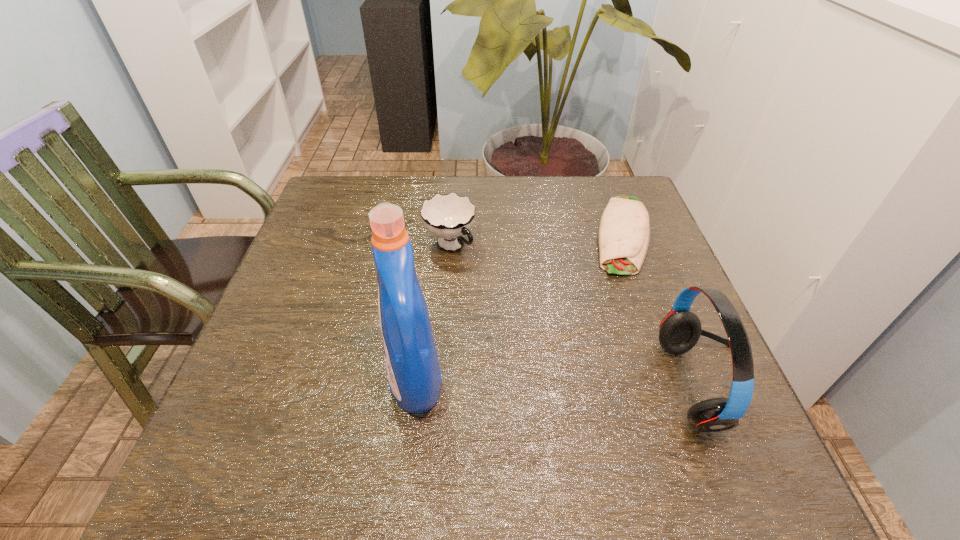
Find the location of a particular element. Image resolution: width=960 pixels, height=540 pixels. free space located at the bitten end of the shortest object is located at coordinates (626, 300).

The height and width of the screenshot is (540, 960). I want to click on free space located at the bitten end of the shortest object, so click(627, 290).

Find the location of `free point located at the bitten end of the shortest object`. free point located at the bitten end of the shortest object is located at coordinates (625, 313).

Locate an element on the screen. The width and height of the screenshot is (960, 540). object situated at the far edge is located at coordinates point(624,232).

The width and height of the screenshot is (960, 540). What are the coordinates of `detergent located at the near edge` in the screenshot? It's located at (414, 376).

This screenshot has width=960, height=540. Identify the location of headset present at the near edge. (680, 330).

In order to click on headset that is positioned at the right edge in this screenshot , I will do `click(680, 330)`.

The width and height of the screenshot is (960, 540). Identify the location of burrito at the right edge. (624, 232).

The image size is (960, 540). Identify the location of object that is at the far right corner. (624, 232).

This screenshot has height=540, width=960. Identify the location of object that is positioned at the near right corner. (680, 330).